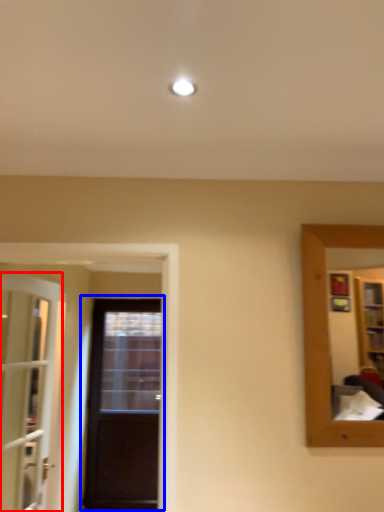
Question: Which object appears farthest to the camera in this image, door (highlighted by a red box) or door (highlighted by a blue box)?

Choices:
 (A) door
 (B) door

Answer: (B)